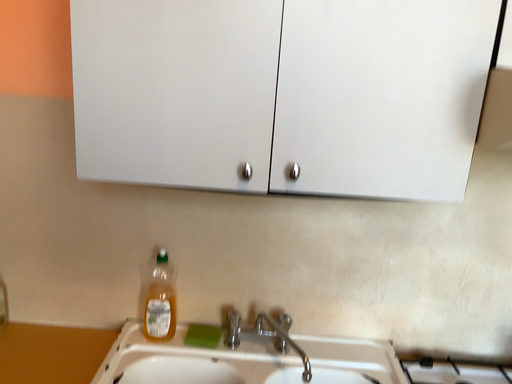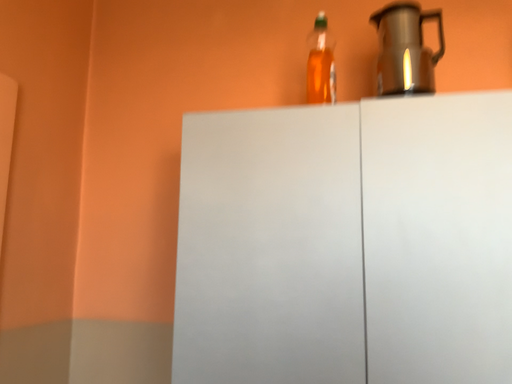
Question: Which way did the camera rotate in the video?

Choices:
 (A) rotated left
 (B) rotated right

Answer: (A)